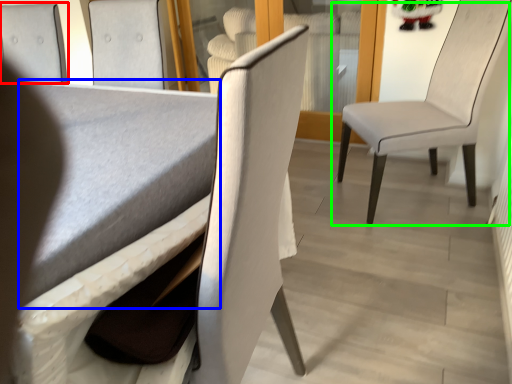
Question: Based on their relative distances, which object is farther from chair (highlighted by a red box)? Choose from table (highlighted by a blue box) and chair (highlighted by a green box).

Choices:
 (A) table
 (B) chair

Answer: (B)